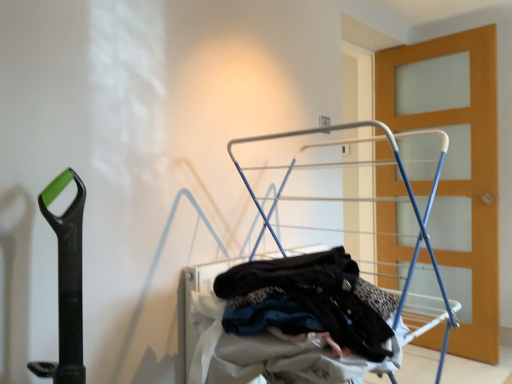
Question: Choose the correct answer: Is white metallic drying rack at center inside wooden door at right or outside it?

Choices:
 (A) inside
 (B) outside

Answer: (B)

Question: Considering the positions of white metallic drying rack at center and wooden door at right in the image, is white metallic drying rack at center wider or thinner than wooden door at right?

Choices:
 (A) thin
 (B) wide

Answer: (B)

Question: From the image's perspective, is white metallic drying rack at center located above or below wooden door at right?

Choices:
 (A) above
 (B) below

Answer: (B)

Question: Considering the positions of wooden door at right and white metallic drying rack at center in the image, is wooden door at right wider or thinner than white metallic drying rack at center?

Choices:
 (A) wide
 (B) thin

Answer: (B)

Question: In terms of size, does wooden door at right appear bigger or smaller than white metallic drying rack at center?

Choices:
 (A) big
 (B) small

Answer: (B)

Question: Do you think wooden door at right is within white metallic drying rack at center, or outside of it?

Choices:
 (A) outside
 (B) inside

Answer: (A)

Question: From the image's perspective, is wooden door at right above or below white metallic drying rack at center?

Choices:
 (A) below
 (B) above

Answer: (B)